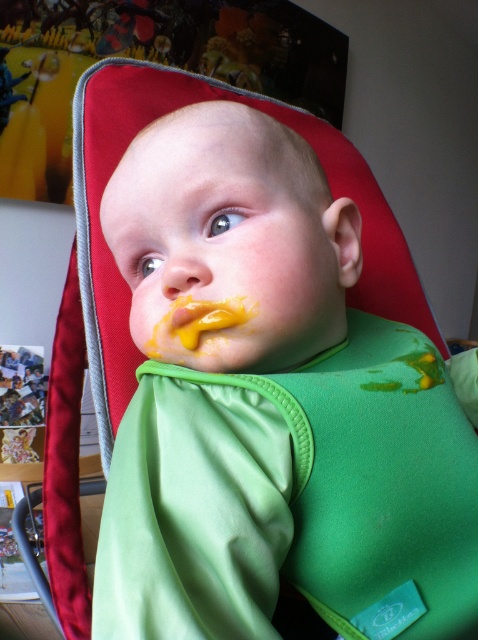
Does yellow smooth paste at center have a lesser height compared to yellow matte nose at center?

Yes.

In order to click on yellow smooth paste at center in this screenshot , I will do `click(205, 317)`.

Where is `yellow smooth paste at center`? The height and width of the screenshot is (640, 478). yellow smooth paste at center is located at coordinates [x=205, y=317].

Is green soft bib at center positioned at the back of yellow smooth paste at center?

That is False.

The image size is (478, 640). Describe the element at coordinates (275, 410) in the screenshot. I see `green soft bib at center` at that location.

I want to click on green soft bib at center, so [275, 410].

Is green soft bib at center to the left of yellow matte nose at center from the viewer's perspective?

Incorrect, green soft bib at center is not on the left side of yellow matte nose at center.

Where is `green soft bib at center`? Image resolution: width=478 pixels, height=640 pixels. green soft bib at center is located at coordinates (275, 410).

The height and width of the screenshot is (640, 478). What do you see at coordinates (275, 410) in the screenshot?
I see `green soft bib at center` at bounding box center [275, 410].

You are a GUI agent. You are given a task and a screenshot of the screen. Output one action in this format:
    pyautogui.click(x=<x>, y=<y>)
    Task: Click on the green soft bib at center
    The height and width of the screenshot is (640, 478).
    Given the screenshot: What is the action you would take?
    pyautogui.click(x=275, y=410)